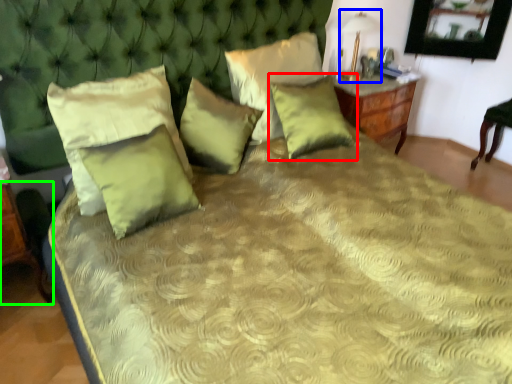
Question: Considering the real-world distances, which object is closest to pillow (highlighted by a red box)? table lamp (highlighted by a blue box) or table (highlighted by a green box).

Choices:
 (A) table lamp
 (B) table

Answer: (A)